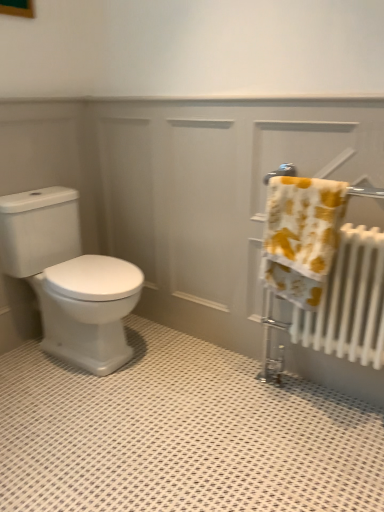
Image resolution: width=384 pixels, height=512 pixels. I want to click on spots to the right of white glossy toilet at left, so (180, 364).